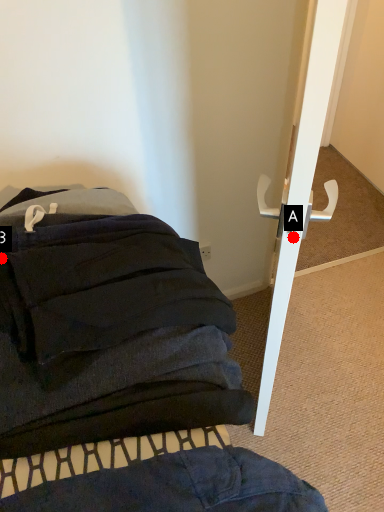
Question: Two points are circled on the image, labeled by A and B beside each circle. Which of the following is the farthest from the observer?

Choices:
 (A) A is further
 (B) B is further

Answer: (A)